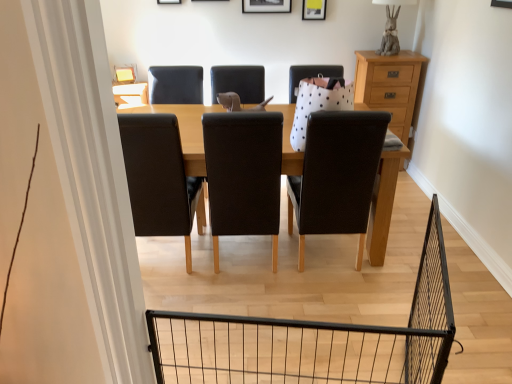
Question: Would you say black matte picture frame at upper center, which is the second picture frame in right-to-left order, is inside or outside matte yellow picture frame at upper center, placed as the first picture frame when sorted from right to left?

Choices:
 (A) inside
 (B) outside

Answer: (B)

Question: Is black matte picture frame at upper center, which is the second picture frame in right-to-left order, to the left or to the right of matte yellow picture frame at upper center, which ranks as the second picture frame in left-to-right order, in the image?

Choices:
 (A) right
 (B) left

Answer: (B)

Question: Which object is the closest to the matte yellow picture frame at upper center, which ranks as the second picture frame in left-to-right order?

Choices:
 (A) light brown wooden chest of drawers at right
 (B) black matte picture frame at upper center, positioned as the 1th picture frame in left-to-right order

Answer: (B)

Question: Which is nearer to the matte yellow picture frame at upper center, placed as the first picture frame when sorted from right to left?

Choices:
 (A) light brown wooden chest of drawers at right
 (B) black matte picture frame at upper center, positioned as the 1th picture frame in left-to-right order

Answer: (B)